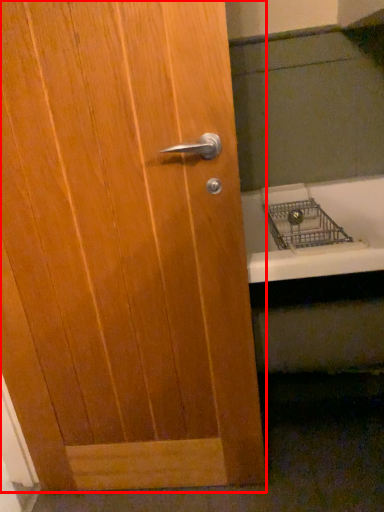
Question: From the image's perspective, considering the relative positions of door (annotated by the red box) and bath in the image provided, where is door (annotated by the red box) located with respect to the staircase?

Choices:
 (A) below
 (B) above

Answer: (A)